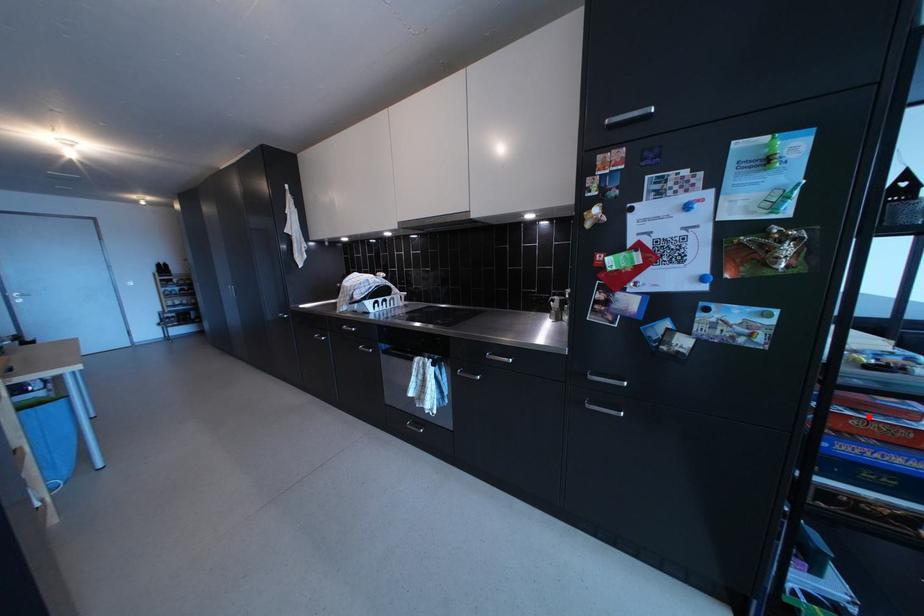
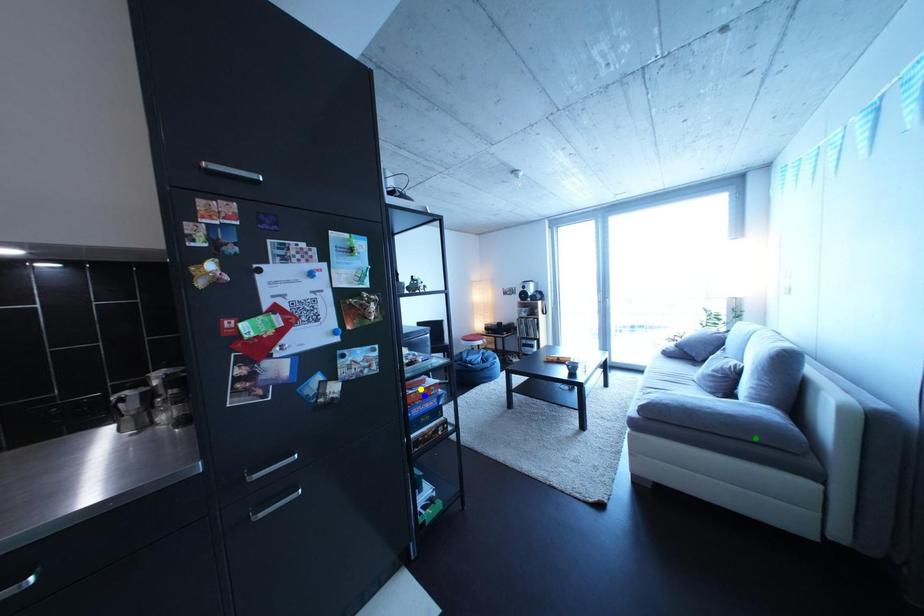
Question: I am providing you with two images of the same scene from different viewpoints. A red point is marked on the first image. You are given multiple points on the second image. Can you choose the point in image 2 that corresponds to the point in image 1?

Choices:
 (A) blue point
 (B) green point
 (C) yellow point

Answer: (A)